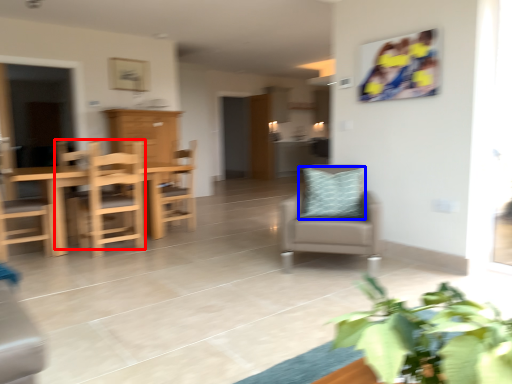
Question: Which of the following is the closest to the observer, chair (highlighted by a red box) or pillow (highlighted by a blue box)?

Choices:
 (A) chair
 (B) pillow

Answer: (B)